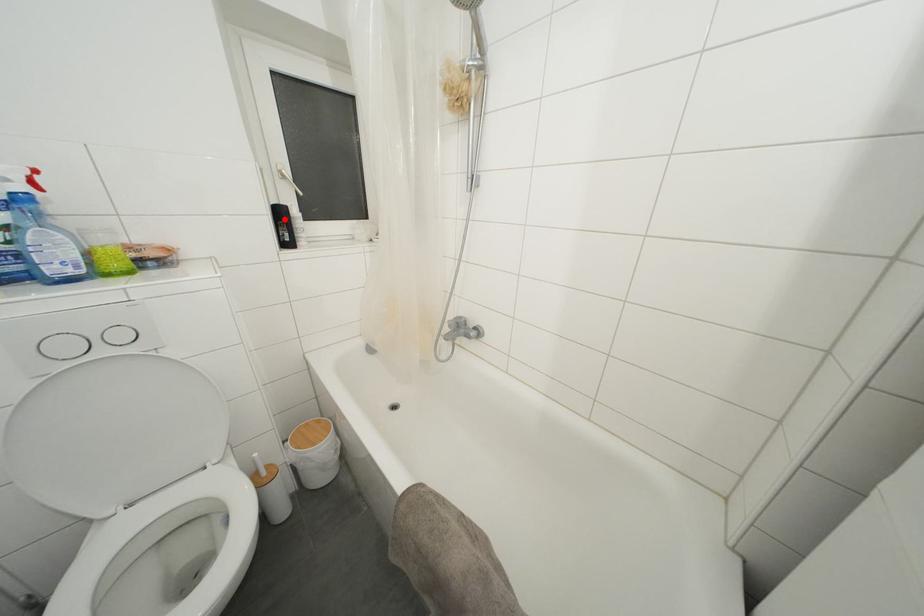
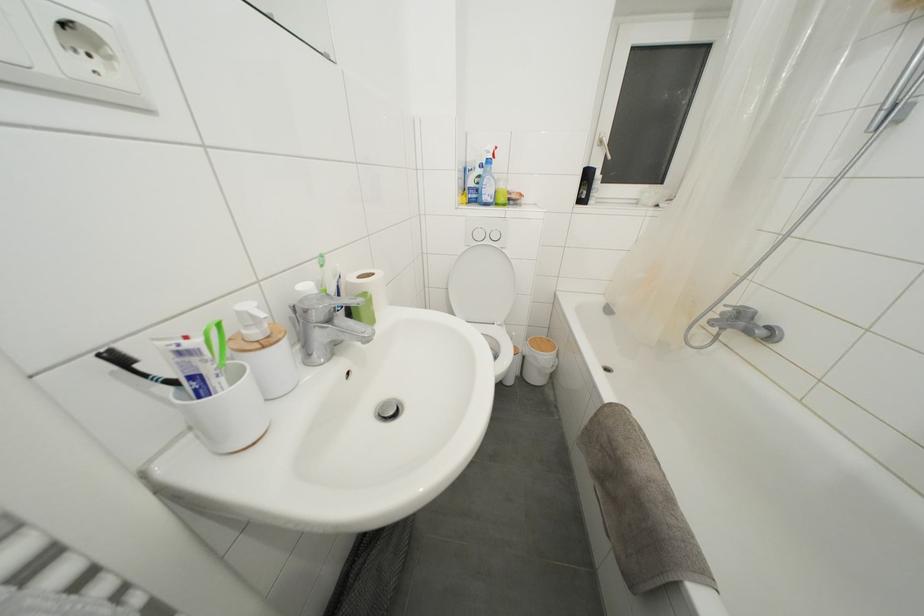
Where in the second image is the point corresponding to the highlighted location from the first image?

(591, 180)